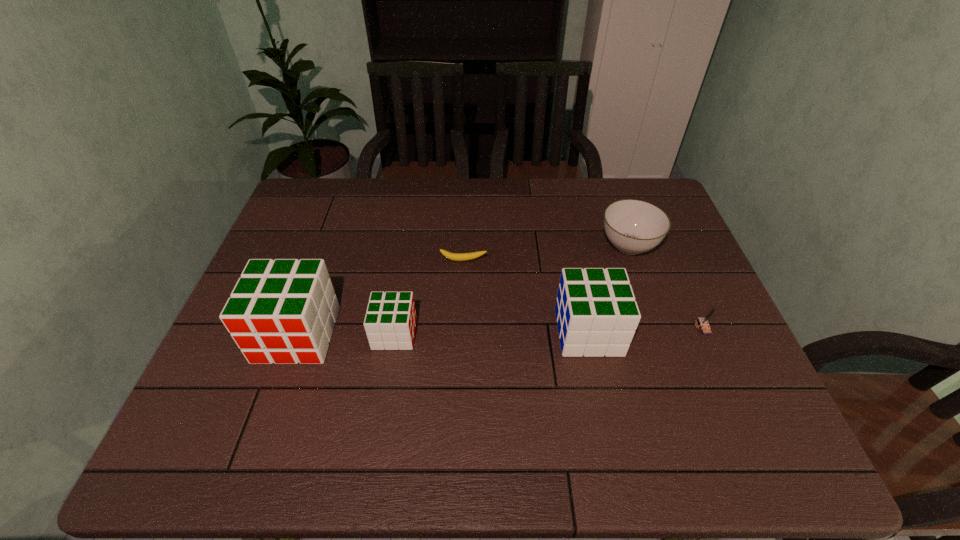
If we want them evenly spaced by inserting an extra cube among them, please locate a free spot for this new cube. Please provide its 2D coordinates. Your answer should be formatted as a tuple, i.e. [(x, y)], where the tuple contains the x and y coordinates of a point satisfying the conditions above.

[(492, 333)]